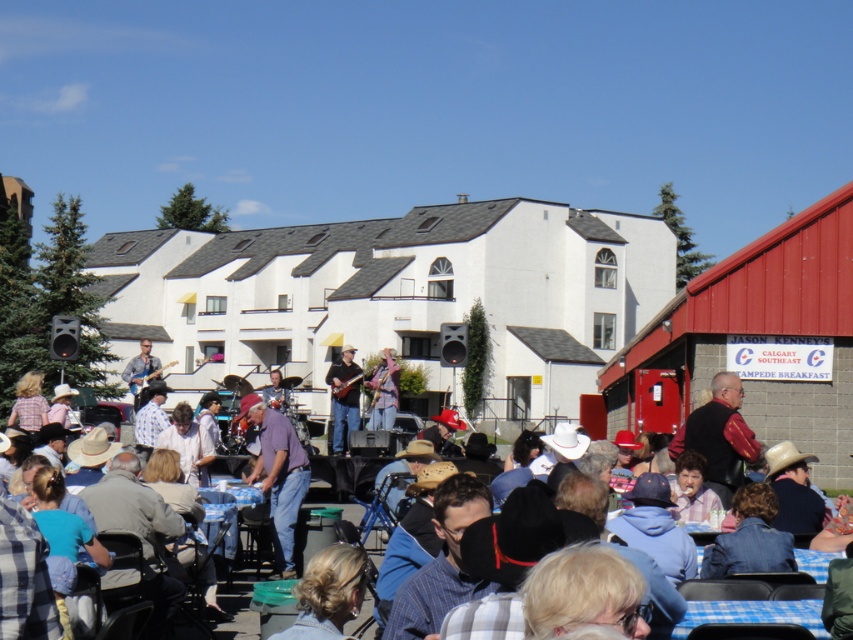
This screenshot has height=640, width=853. I want to click on purple cotton shirt at center, so click(277, 476).

Is point (267, 481) positioned behind point (381, 413)?

No, (267, 481) is in front of (381, 413).

I want to click on purple cotton shirt at center, so click(x=277, y=476).

Does denim jacket at center appear over matte brown guitar at center?

No.

Between point (798, 621) and point (332, 374), which one is positioned behind?

Positioned behind is point (332, 374).

I want to click on denim jacket at center, so click(x=752, y=612).

Can you confirm if purple cotton shirt at center is wider than denim jacket at center?

In fact, purple cotton shirt at center might be narrower than denim jacket at center.

Between purple cotton shirt at center and denim jacket at center, which one has more height?

Standing taller between the two is denim jacket at center.

Does point (277, 516) come farther from viewer compared to point (793, 609)?

Yes, it is behind point (793, 609).

I want to click on purple cotton shirt at center, so point(277,476).